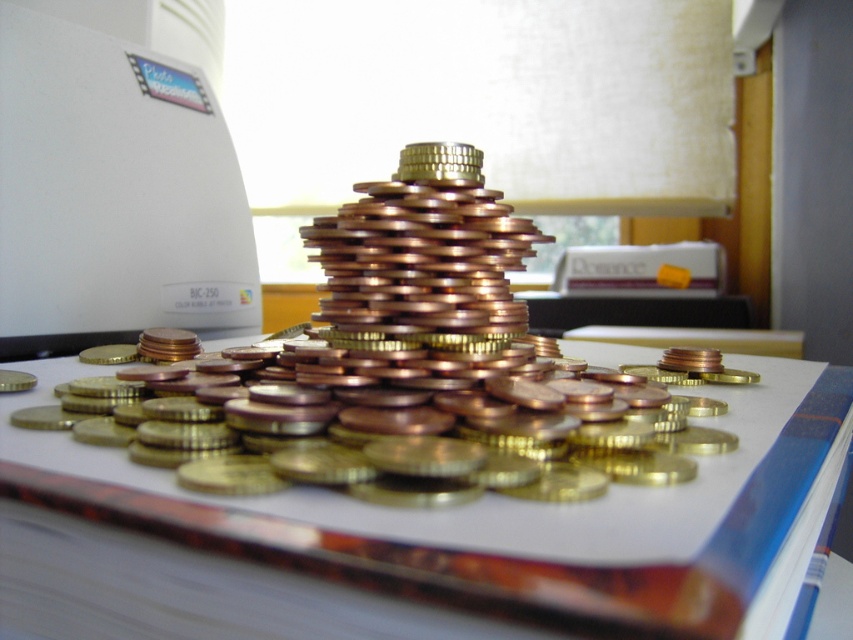
Consider the image. You are organizing coins on a desk and notice two groups of coins labeled as metallic gold coins at center and gold shiny coins at center. Which group is located below the other?

The metallic gold coins at center are positioned under the gold shiny coins at center.

You are organizing coins for a display and have both metallic gold coins at center and gold shiny coins at center. If you want to create a stable base for the pyramid, which type of coin should you use for the bottom layer?

The metallic gold coins at center should be used for the bottom layer because their larger width provides a more stable base compared to the narrower gold shiny coins at center.